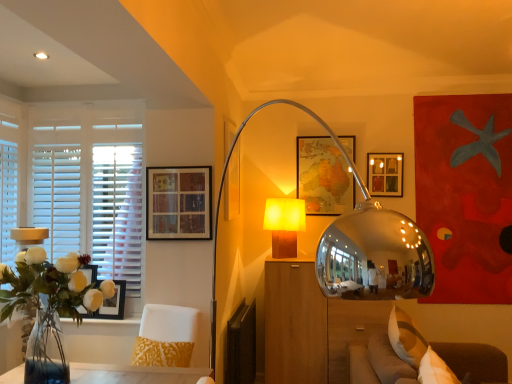
This screenshot has height=384, width=512. I want to click on free point above white wooden blinds at left (from a real-world perspective), so click(x=83, y=92).